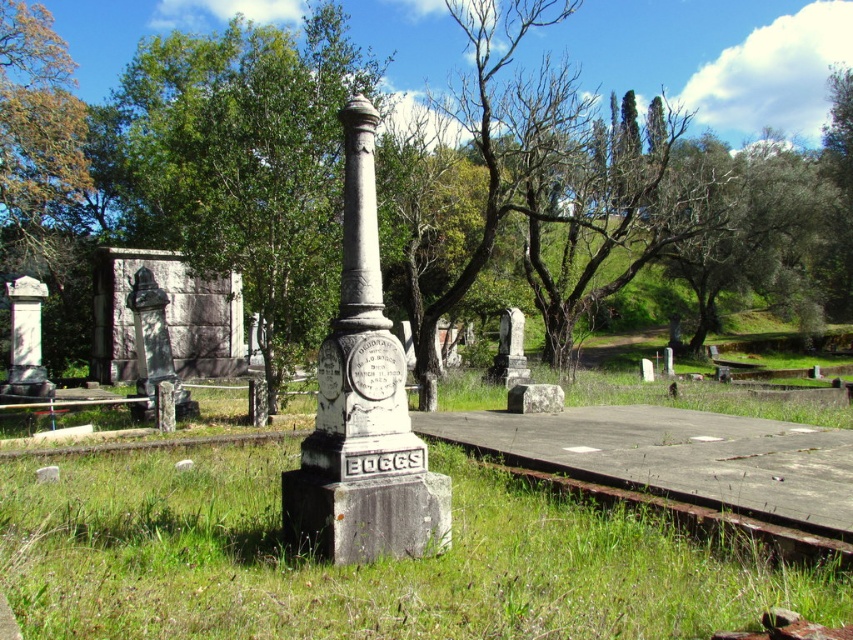
Is green leafy tree at center above bronze statue at left?

Yes.

Can you confirm if green leafy tree at center is positioned to the left of bronze statue at left?

No, green leafy tree at center is not to the left of bronze statue at left.

The width and height of the screenshot is (853, 640). Find the location of `green leafy tree at center`. green leafy tree at center is located at coordinates (599, 195).

Find the location of a particular element. This screenshot has height=640, width=853. green leafy tree at center is located at coordinates (599, 195).

Between green leafy tree at center and green grass at center, which one has more height?

green leafy tree at center is taller.

From the picture: Is green leafy tree at center to the right of green grass at center from the viewer's perspective?

Yes, green leafy tree at center is to the right of green grass at center.

Is point (724, 170) more distant than point (44, 509)?

That is True.

This screenshot has width=853, height=640. I want to click on green leafy tree at center, so click(599, 195).

Locate an element on the screen. The width and height of the screenshot is (853, 640). green grass at center is located at coordinates (366, 564).

Can you confirm if green grass at center is smaller than bronze statue at left?

Yes.

Between point (230, 531) and point (137, 410), which one is positioned behind?

The point (137, 410) is behind.

You are a GUI agent. You are given a task and a screenshot of the screen. Output one action in this format:
    pyautogui.click(x=<x>, y=<y>)
    Task: Click on the green grass at center
    The image size is (853, 640).
    Given the screenshot: What is the action you would take?
    pyautogui.click(x=366, y=564)